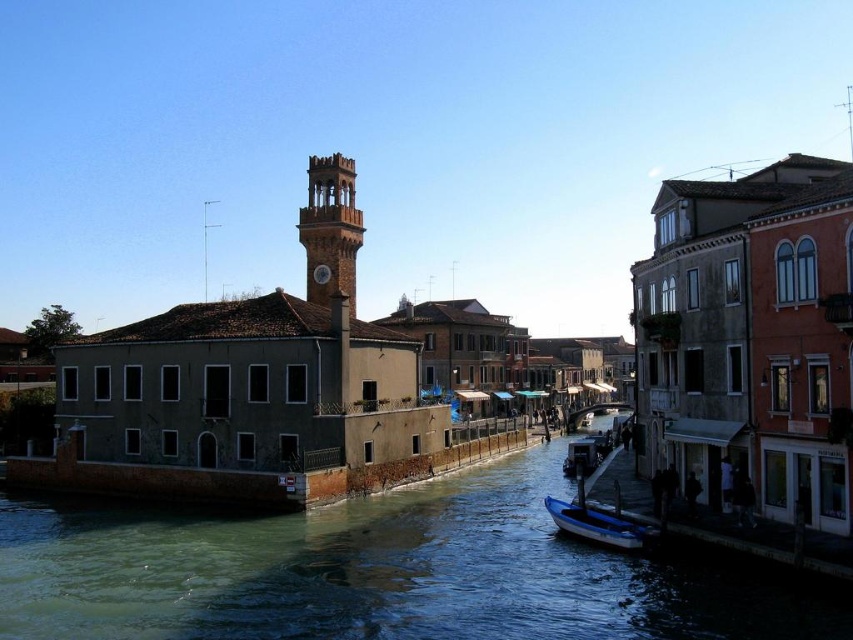
Is brown stone clock tower at center positioned at the back of blue glossy boat at lower center?

Yes, it is behind blue glossy boat at lower center.

Consider the image. Can you confirm if brown stone clock tower at center is smaller than blue glossy boat at lower center?

No, brown stone clock tower at center is not smaller than blue glossy boat at lower center.

Is point (305, 205) closer to camera compared to point (618, 536)?

No, it is behind (618, 536).

Locate an element on the screen. The height and width of the screenshot is (640, 853). brown stone clock tower at center is located at coordinates (329, 228).

Does greenish water at center appear under brown stone clock tower at center?

Yes.

Which is more to the left, greenish water at center or brown stone clock tower at center?

From the viewer's perspective, brown stone clock tower at center appears more on the left side.

Does point (672, 621) come closer to viewer compared to point (350, 218)?

That is True.

Find the location of a particular element. The width and height of the screenshot is (853, 640). greenish water at center is located at coordinates (374, 572).

Does greenish water at center have a greater width compared to blue glossy boat at lower center?

Yes.

Describe the element at coordinates (374, 572) in the screenshot. I see `greenish water at center` at that location.

Is point (828, 637) less distant than point (611, 516)?

Yes, point (828, 637) is in front of point (611, 516).

Locate an element on the screen. greenish water at center is located at coordinates (374, 572).